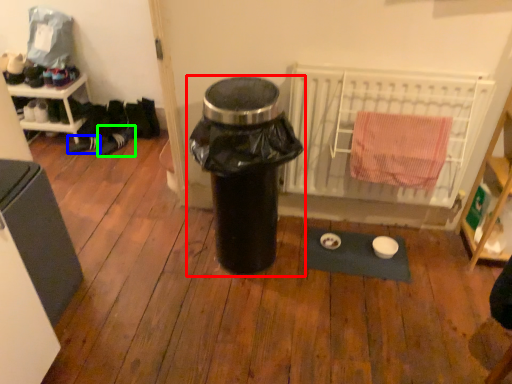
Question: Which object is positioned closest to waste container (highlighted by a red box)? Select from shoe (highlighted by a blue box) and shoe (highlighted by a green box).

Choices:
 (A) shoe
 (B) shoe

Answer: (B)